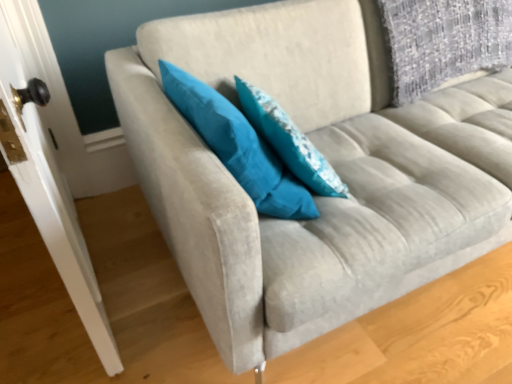
Question: From the image's perspective, relative to teal fabric pillow at center, placed as the second pillow when sorted from right to left, is white glossy door handle at left above or below?

Choices:
 (A) above
 (B) below

Answer: (B)

Question: Is point (87, 263) positioned closer to the camera than point (259, 140)?

Choices:
 (A) closer
 (B) farther

Answer: (B)

Question: Considering the real-world distances, which object is closest to the white glossy door handle at left?

Choices:
 (A) teal fabric pillow at center, which is the first pillow from right to left
 (B) teal fabric pillow at center, placed as the second pillow when sorted from right to left

Answer: (B)

Question: Estimate the real-world distances between objects in this image. Which object is closer to the white glossy door handle at left?

Choices:
 (A) teal fabric pillow at center, which is the first pillow from right to left
 (B) teal fabric pillow at center, placed as the second pillow when sorted from right to left

Answer: (B)